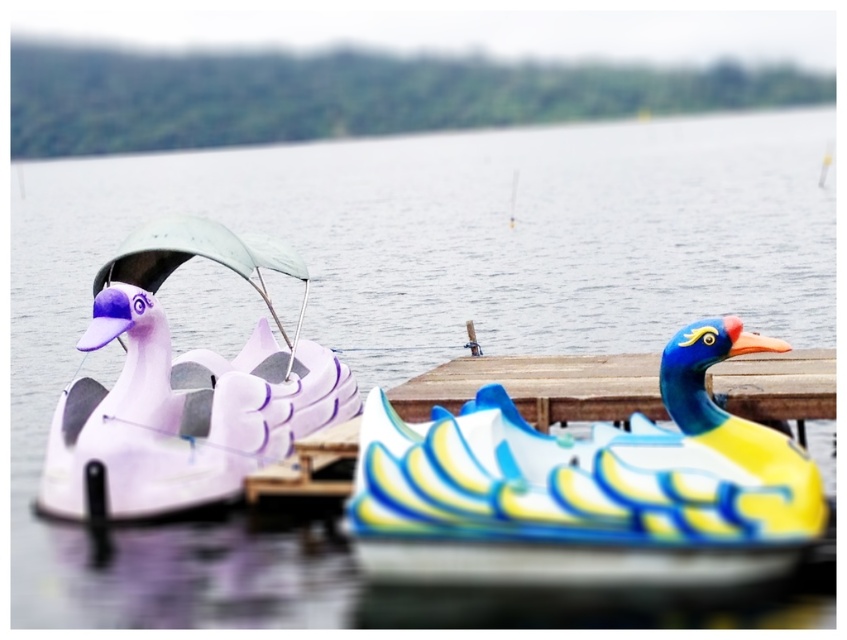
You are standing on the wooden dock and see the point at coordinates (183, 388). Which object is this point located on?

The point at coordinates (183, 388) is located on the matte purple duck at left.